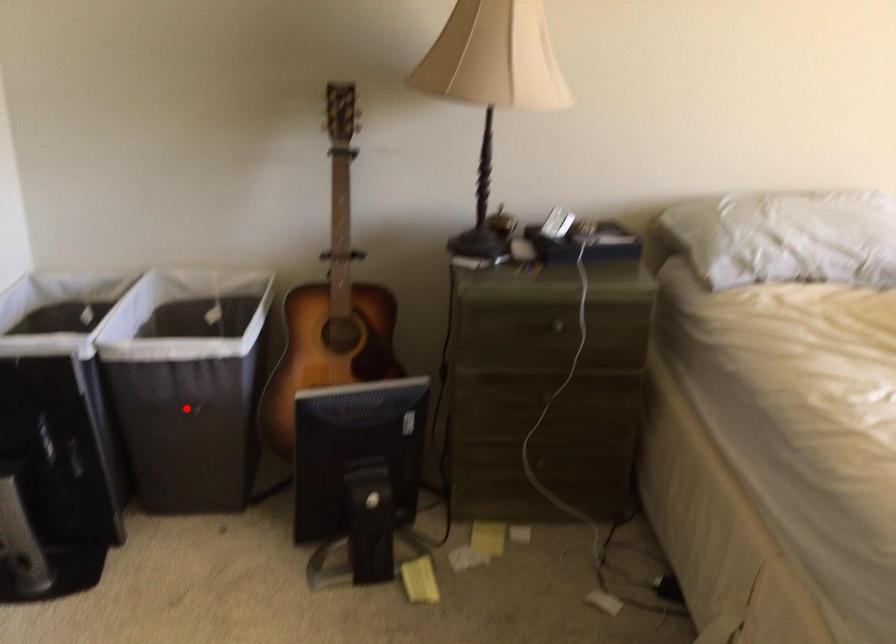
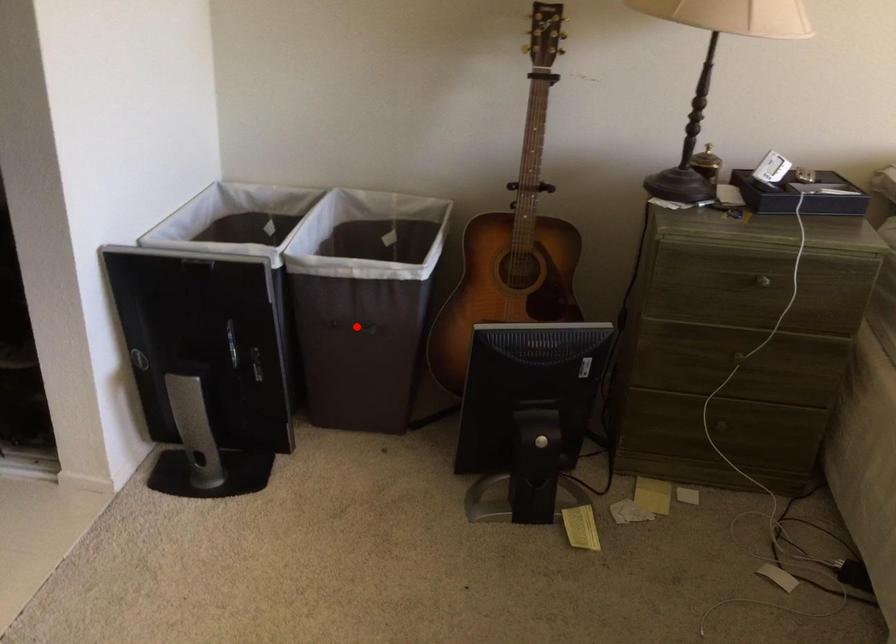
I am providing you with two images of the same scene from different viewpoints. A red point is marked on the first image and another point is marked on the second image. Do the highlighted points in image1 and image2 indicate the same real-world spot?

Yes